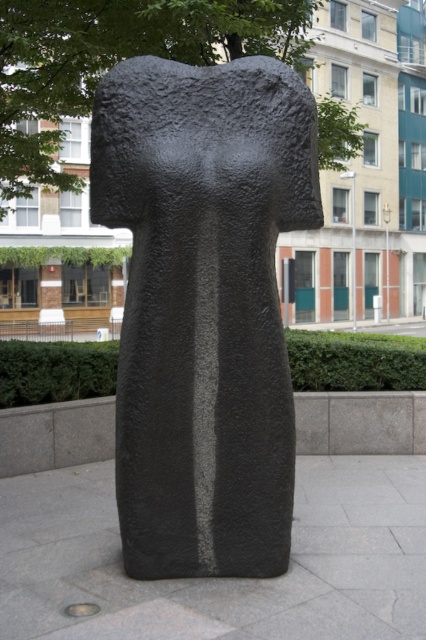
Question: Observing the image, what is the correct spatial positioning of black rough stone statue at center in reference to green leafy tree at upper center?

Choices:
 (A) above
 (B) below

Answer: (B)

Question: In this image, where is black rough stone statue at center located relative to green leafy tree at upper center?

Choices:
 (A) below
 (B) above

Answer: (A)

Question: Which point is farther from the camera taking this photo?

Choices:
 (A) (131, 19)
 (B) (181, 396)

Answer: (A)

Question: Which point appears closest to the camera in this image?

Choices:
 (A) (175, 394)
 (B) (201, 8)

Answer: (A)

Question: Can you confirm if black rough stone statue at center is positioned to the left of green leafy tree at upper center?

Choices:
 (A) no
 (B) yes

Answer: (B)